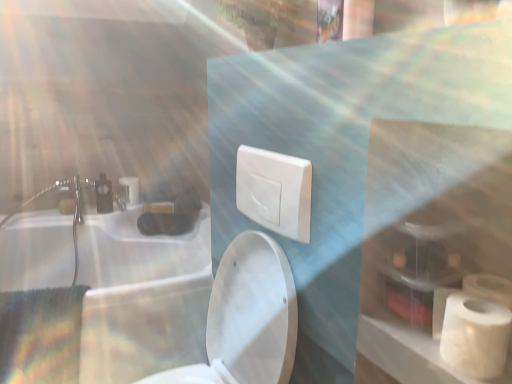
Question: Can you confirm if white glossy sink at upper left is thinner than matte white faucet at upper left?

Choices:
 (A) yes
 (B) no

Answer: (B)

Question: Is white glossy sink at upper left closer to the viewer compared to matte white faucet at upper left?

Choices:
 (A) no
 (B) yes

Answer: (B)

Question: Is white glossy sink at upper left facing away from matte white faucet at upper left?

Choices:
 (A) yes
 (B) no

Answer: (B)

Question: Can you confirm if white glossy sink at upper left is positioned to the left of matte white faucet at upper left?

Choices:
 (A) yes
 (B) no

Answer: (B)

Question: From the image's perspective, does white glossy sink at upper left appear higher than matte white faucet at upper left?

Choices:
 (A) no
 (B) yes

Answer: (A)

Question: From a real-world perspective, is white glossy sink at upper left located beneath matte white faucet at upper left?

Choices:
 (A) no
 (B) yes

Answer: (B)

Question: Are white glossy toilet at center and white matte toilet paper at right, the first toilet paper when ordered from right to left, beside each other?

Choices:
 (A) yes
 (B) no

Answer: (B)

Question: Is white glossy toilet at center far from white matte toilet paper at right, arranged as the second toilet paper when viewed from the back?

Choices:
 (A) no
 (B) yes

Answer: (A)

Question: Does white glossy toilet at center have a smaller size compared to white matte toilet paper at right, the second toilet paper viewed from the left?

Choices:
 (A) yes
 (B) no

Answer: (B)

Question: From a real-world perspective, is white glossy toilet at center below white matte toilet paper at right, the second toilet paper viewed from the left?

Choices:
 (A) no
 (B) yes

Answer: (B)

Question: Is white glossy toilet at center facing towards white matte toilet paper at right, the first toilet paper ordered from the bottom?

Choices:
 (A) no
 (B) yes

Answer: (A)

Question: From the image's perspective, does white glossy toilet at center appear lower than white matte toilet paper at right, positioned as the first toilet paper in front-to-back order?

Choices:
 (A) yes
 (B) no

Answer: (A)

Question: Considering the relative sizes of white matte toilet paper at right, the first toilet paper when ordered from right to left, and white matte toiletry bag at lower right in the image provided, is white matte toilet paper at right, the first toilet paper when ordered from right to left, bigger than white matte toiletry bag at lower right?

Choices:
 (A) no
 (B) yes

Answer: (A)